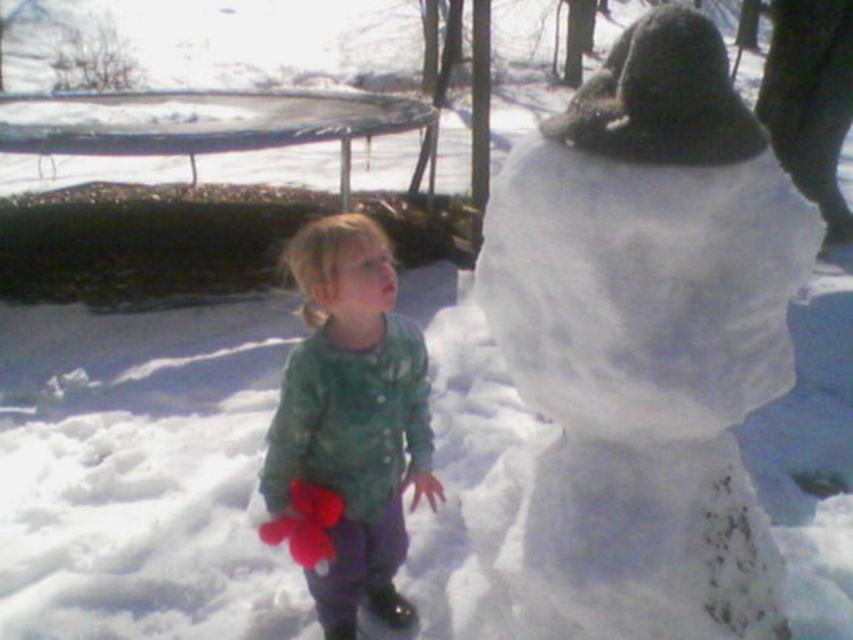
You are a parent trying to ensure your child stays within a safe distance while playing in the snow. The child is wearing the green textured coat at center and is near the white fluffy snowman at upper right. According to the image, is the child within a 20 inch safety zone from the snowman?

The distance between the white fluffy snowman at upper right and the green textured coat at center is 19.77 inches, which is within the 20 inch safety zone.

You are a parent trying to decide whether to let your child play near the white fluffy snowman at upper right and the green textured coat at center. Considering their sizes, which object is taller and could potentially block the child from seeing the other? Please name the taller object.

The white fluffy snowman at upper right is much taller than the green textured coat at center, so it could potentially block the child from seeing the other.